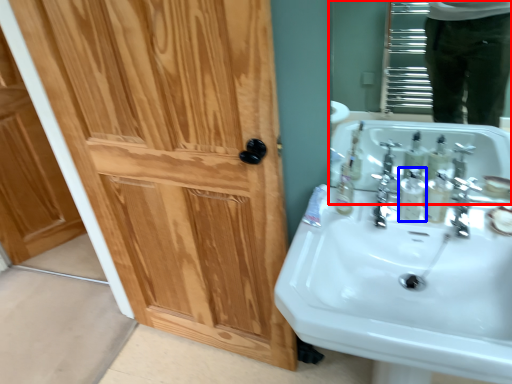
Question: Which object appears farthest to the camera in this image, mirror (highlighted by a red box) or mouthwash (highlighted by a blue box)?

Choices:
 (A) mirror
 (B) mouthwash

Answer: (B)